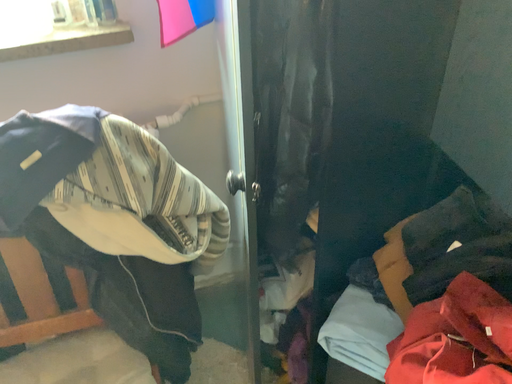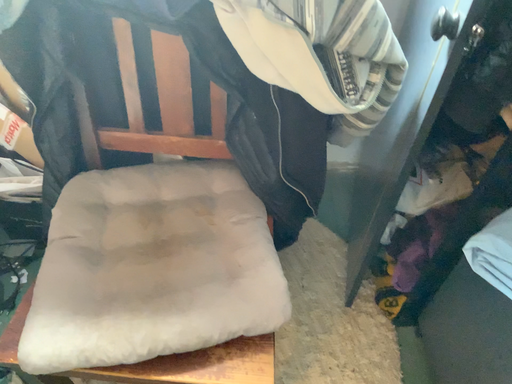
Question: How did the camera likely rotate when shooting the video?

Choices:
 (A) rotated left
 (B) rotated right

Answer: (A)